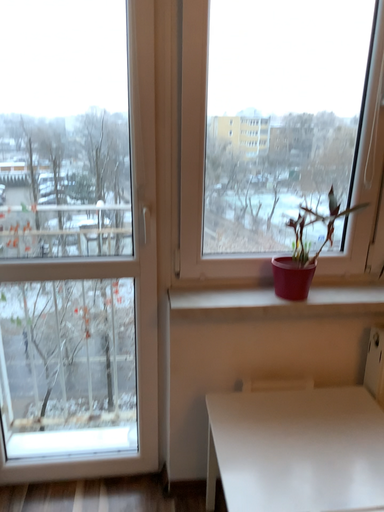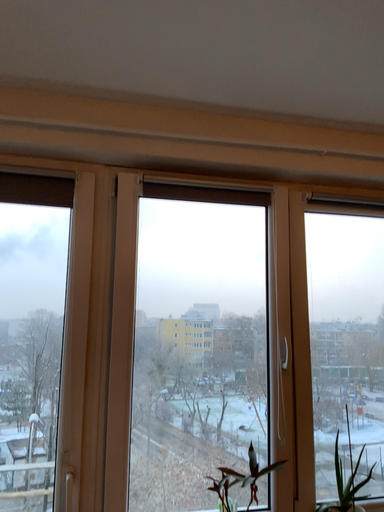
Question: How did the camera likely rotate when shooting the video?

Choices:
 (A) rotated left
 (B) rotated right

Answer: (B)